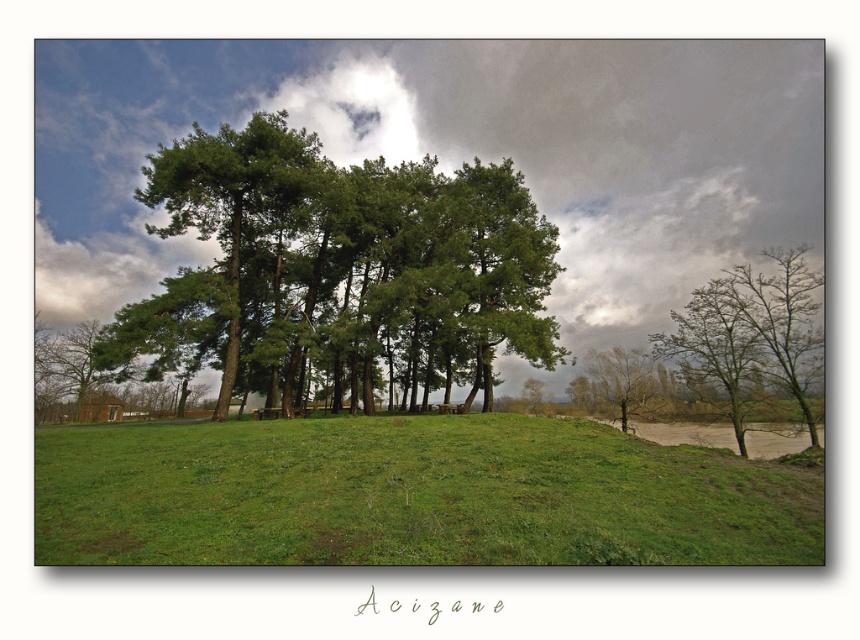
Does green matte tree at center have a lesser width compared to bare branches tree at lower right?

No.

Which is behind, point (189, 220) or point (617, 396)?

Positioned behind is point (617, 396).

Image resolution: width=860 pixels, height=640 pixels. I want to click on green matte tree at center, so click(x=336, y=268).

Does green grassy field at center have a greater height compared to bare branches tree at lower right?

No.

Who is more distant from viewer, (329, 444) or (627, 419)?

Point (627, 419)

In order to click on green grassy field at center in this screenshot , I will do `click(412, 496)`.

Describe the element at coordinates (412, 496) in the screenshot. This screenshot has height=640, width=860. I see `green grassy field at center` at that location.

Measure the distance from green grassy field at center to green matte tree at center.

11.01 meters

The width and height of the screenshot is (860, 640). What do you see at coordinates (412, 496) in the screenshot? I see `green grassy field at center` at bounding box center [412, 496].

The width and height of the screenshot is (860, 640). Find the location of `green grassy field at center`. green grassy field at center is located at coordinates (412, 496).